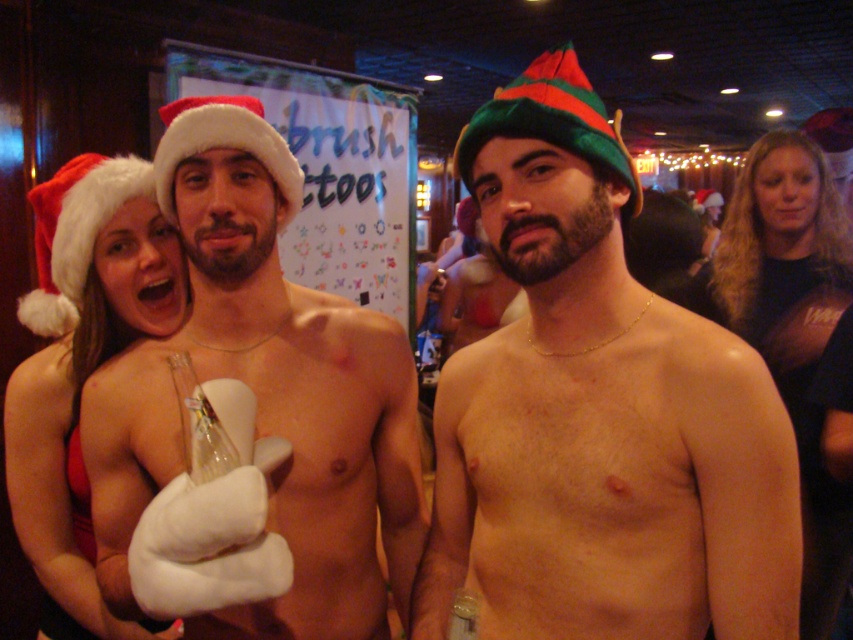
You are a photographer at the event and need to capture a photo of the black matte shirt at upper right and the green felt christmas hat at center. Which object should you focus on first if you want to ensure both are in focus without adjusting the camera settings?

The black matte shirt at upper right is positioned under the green felt christmas hat at center, so focusing on the green felt christmas hat at center first would ensure both are in focus since it is closer to the camera.

You are standing at the point with coordinates point [479,140] and want to move to the exit located at point [804,353]. Is there a clear path from your current position to the exit without needing to go around any obstacles?

Point [804,353] is behind point [479,140], so you cannot reach the exit directly because the exit is located behind your current position. You will need to move around obstacles or find another path.

You are standing in the festive scene and want to place a decorative snow globe at the exact center of the image. The snow globe has a diameter of 10 cm. Given that the shiny metallic hat at center is located at coordinates point 0.648, 0.702, can you determine if placing the snow globe there would cover the hat?

The shiny metallic hat at center is located at coordinates point (598, 413). Since the snow globe is placed at the exact center of the image, which is different from the hat location, placing the snow globe there would not cover the hat.